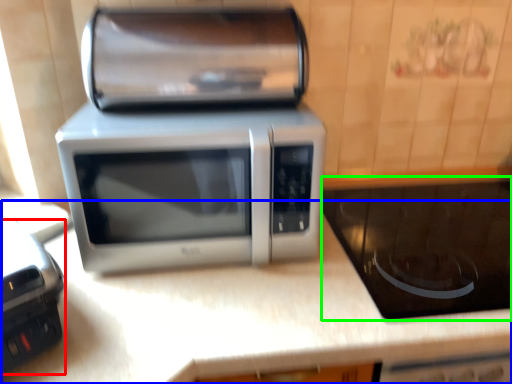
Question: Which object is the closest to the appliance (highlighted by a red box)? Choose among these: counter top (highlighted by a blue box) or appliance (highlighted by a green box).

Choices:
 (A) counter top
 (B) appliance

Answer: (A)